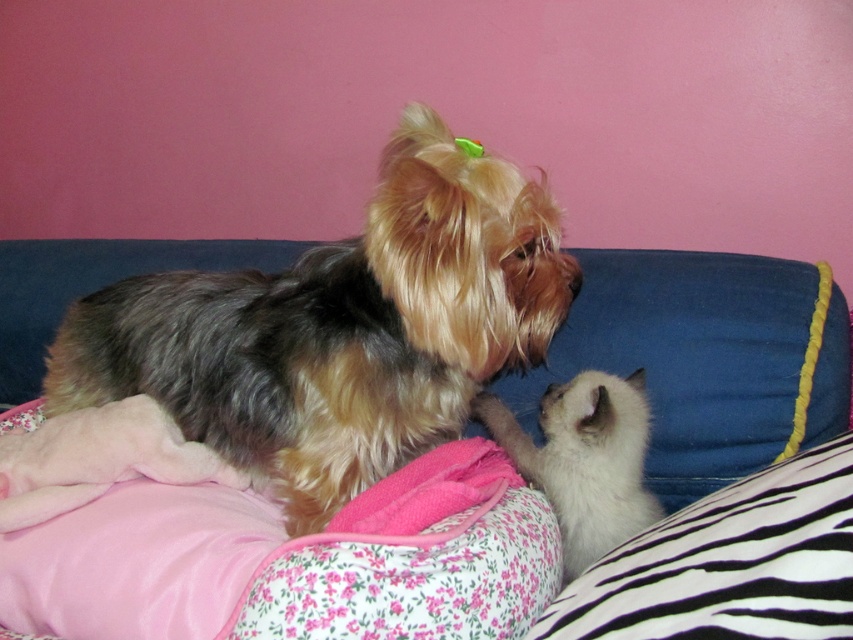
Which of these two, shaggy brown dog at center or white fluffy cat at center, stands taller?

shaggy brown dog at center is taller.

Can you confirm if shaggy brown dog at center is positioned to the right of white fluffy cat at center?

In fact, shaggy brown dog at center is to the left of white fluffy cat at center.

Measure the distance between point (x=457, y=378) and camera.

Point (x=457, y=378) and camera are 1.11 meters apart from each other.

This screenshot has width=853, height=640. I want to click on shaggy brown dog at center, so click(339, 328).

Looking at this image, can you confirm if shaggy brown dog at center is shorter than blue fabric couch at center?

Incorrect, shaggy brown dog at center's height does not fall short of blue fabric couch at center's.

Is point (125, 362) farther from camera compared to point (825, 336)?

That is True.

Between point (416, 371) and point (26, 250), which one is positioned behind?

Point (26, 250)

Where is `shaggy brown dog at center`? The height and width of the screenshot is (640, 853). shaggy brown dog at center is located at coordinates coord(339,328).

In the scene shown: Is blue fabric couch at center wider than white fluffy cat at center?

Correct, the width of blue fabric couch at center exceeds that of white fluffy cat at center.

Describe the element at coordinates (706, 358) in the screenshot. This screenshot has width=853, height=640. I see `blue fabric couch at center` at that location.

Does point (817, 339) lie in front of point (592, 506)?

No.

In order to click on blue fabric couch at center in this screenshot , I will do `click(706, 358)`.